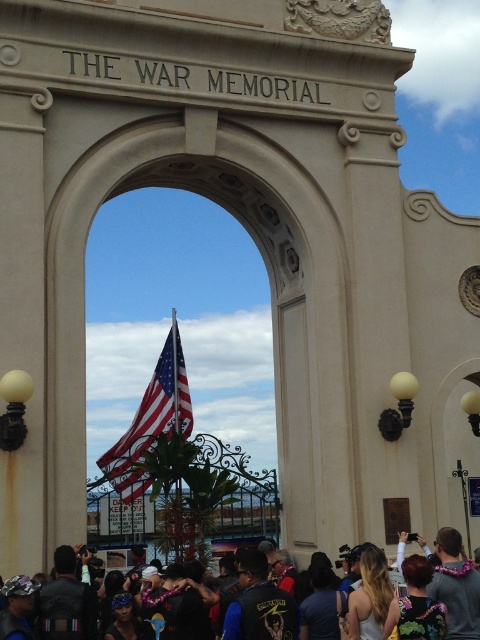
You are standing at the base of the archway labeled THE WAR MEMORIAL. You want to take a photo of the point at coordinates point [231,612]. Your camera has a focal length of 50mm and a sensor size of 24mm x 36mm. What is the minimum distance you need to move forward or backward to ensure the point is within the camera frame?

The point at coordinates point [231,612] is 141.35 feet away from the camera. To ensure the point is within the camera frame, you need to calculate the field of view. Using the formula field of view angle in degrees equals 2 times arctangent of sensor dimension divided by 2 times focal length. For a 50mm lens on a 36mm sensor, the horizontal FOV is approximately 39.6 degrees. The distance to the point is 141.35 feet. The maximum horizontal distance covered by the camera at that distance is 141.35 times T

You are standing in front of the grand archway labeled THE WAR MEMORIAL and see the dark gray leather jackets at lower center. Where exactly are the dark gray leather jackets located in relation to the archway?

The dark gray leather jackets at lower center are located at point (x=450, y=586) in relation to the archway.